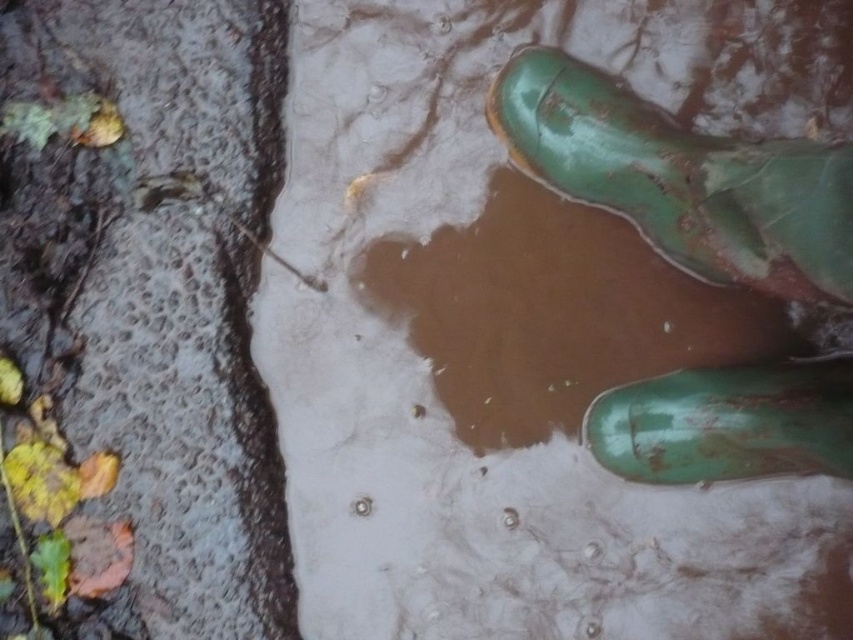
Question: Which point appears farthest from the camera in this image?

Choices:
 (A) (711, 451)
 (B) (270, 602)
 (C) (426, 81)

Answer: (C)

Question: Which of the following is the farthest from the observer?

Choices:
 (A) brown matte mud at lower left
 (B) green rubber boot at upper right
 (C) muddy rubber boots at upper right
 (D) green rubber boot at lower right

Answer: (C)

Question: Can you confirm if muddy rubber boots at upper right is positioned to the left of green rubber boot at lower right?

Choices:
 (A) no
 (B) yes

Answer: (B)

Question: Observing the image, what is the correct spatial positioning of green rubber boot at upper right in reference to green rubber boot at lower right?

Choices:
 (A) below
 (B) above

Answer: (B)

Question: Which point is closer to the camera?

Choices:
 (A) green rubber boot at lower right
 (B) muddy rubber boots at upper right
 (C) green rubber boot at upper right

Answer: (C)

Question: Is muddy rubber boots at upper right above brown matte mud at lower left?

Choices:
 (A) no
 (B) yes

Answer: (B)